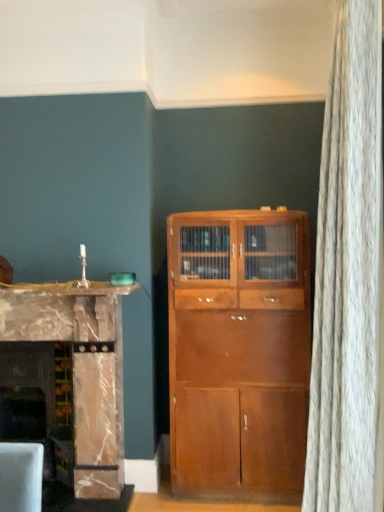
Question: Relative to shiny brown cabinet at center, is marble fireplace at left in front or behind?

Choices:
 (A) behind
 (B) front

Answer: (B)

Question: From a real-world perspective, is marble fireplace at left positioned above or below shiny brown cabinet at center?

Choices:
 (A) above
 (B) below

Answer: (B)

Question: Estimate the real-world distances between objects in this image. Which object is closer to the marble fireplace at left?

Choices:
 (A) shiny brown cabinet at center
 (B) marble fireplace at left

Answer: (B)

Question: Based on their relative distances, which object is nearer to the marble fireplace at left?

Choices:
 (A) marble fireplace at left
 (B) shiny brown cabinet at center

Answer: (A)